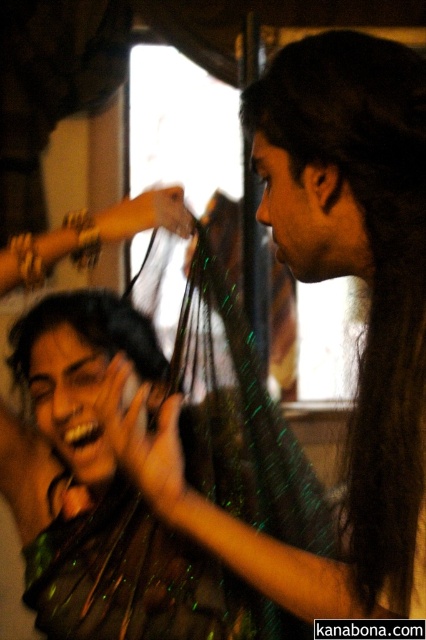
Question: Can you confirm if dark green silky hair at center is wider than shiny black hair at center?

Choices:
 (A) yes
 (B) no

Answer: (B)

Question: From the image, what is the correct spatial relationship of dark green silky hair at center in relation to shiny black hair at center?

Choices:
 (A) above
 (B) below

Answer: (A)

Question: Is dark green silky hair at center positioned at the back of shiny black hair at center?

Choices:
 (A) no
 (B) yes

Answer: (A)